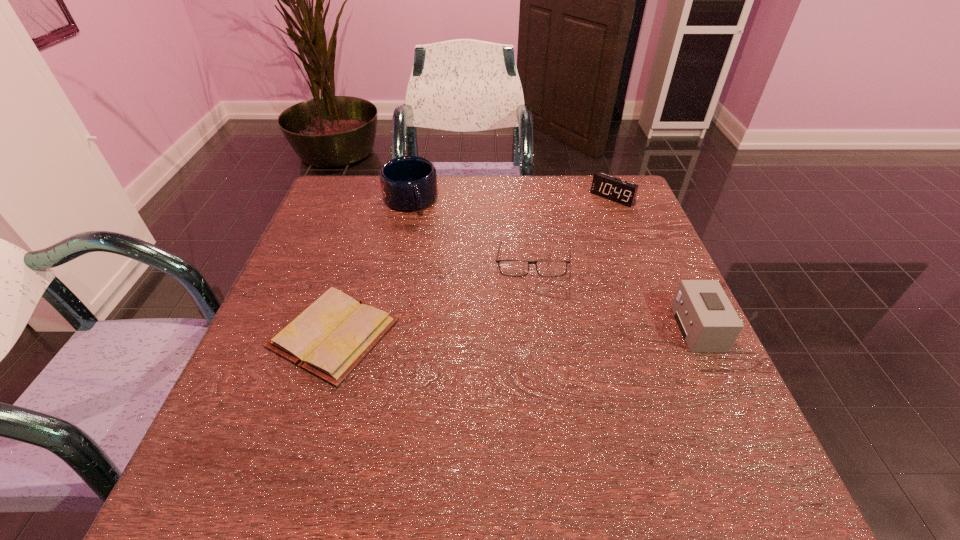
Where is `diary`? diary is located at coordinates [x=329, y=338].

Image resolution: width=960 pixels, height=540 pixels. What are the coordinates of `the nearer alarm clock` in the screenshot? It's located at (708, 322).

Where is `mug`? Image resolution: width=960 pixels, height=540 pixels. mug is located at coordinates (408, 183).

Identify the location of the farther alarm clock. Image resolution: width=960 pixels, height=540 pixels. (617, 190).

Where is `spectacles`? This screenshot has width=960, height=540. spectacles is located at coordinates (517, 268).

Image resolution: width=960 pixels, height=540 pixels. I want to click on the third object from right to left, so click(517, 268).

I want to click on vacant point located on the right of the shortest object, so click(x=592, y=334).

Locate an element on the screen. This screenshot has height=540, width=960. vacant area located with the handle on the side of the mug is located at coordinates (427, 238).

You are a GUI agent. You are given a task and a screenshot of the screen. Output one action in this format:
    pyautogui.click(x=<x>, y=<y>)
    Task: Click on the vacant position located 0.400m with the handle on the side of the mug
    
    Given the screenshot: What is the action you would take?
    pyautogui.click(x=468, y=320)

Where is `blank space located with the handle on the side of the mug`? The image size is (960, 540). blank space located with the handle on the side of the mug is located at coordinates (448, 281).